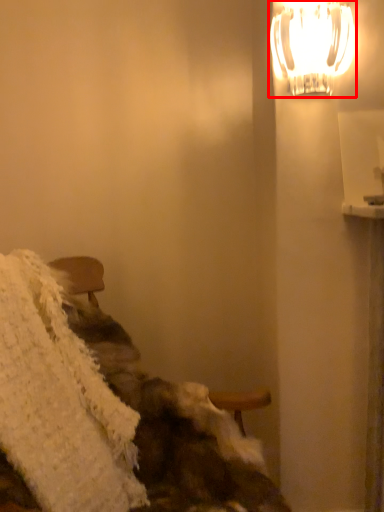
Question: From the image's perspective, where is lamp (annotated by the red box) located relative to blanket?

Choices:
 (A) below
 (B) above

Answer: (B)